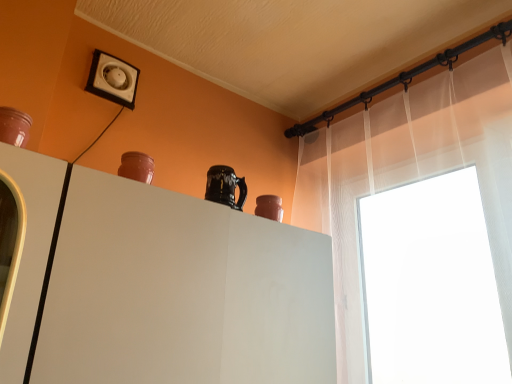
Question: From a real-world perspective, is matte brown vase at upper left, which is counted as the second vase, starting from the right, positioned above or below sheer white curtain at upper right?

Choices:
 (A) above
 (B) below

Answer: (B)

Question: From the image's perspective, is matte brown vase at upper left, the second vase positioned from the back, positioned above or below sheer white curtain at upper right?

Choices:
 (A) below
 (B) above

Answer: (B)

Question: Considering the real-world distances, which object is closest to the white plastic electric outlet at upper left?

Choices:
 (A) matte brown vase at upper left, acting as the 1th vase starting from the top
 (B) white matte cabinet at center
 (C) matte clay vase at upper right, the first vase positioned from the back
 (D) sheer white curtain at upper right

Answer: (A)

Question: Estimate the real-world distances between objects in this image. Which object is farther from the matte brown vase at upper left, the 2th vase in the bottom-to-top sequence?

Choices:
 (A) matte clay vase at upper right, the 2th vase from the left
 (B) white matte cabinet at center
 (C) white plastic electric outlet at upper left
 (D) sheer white curtain at upper right

Answer: (D)